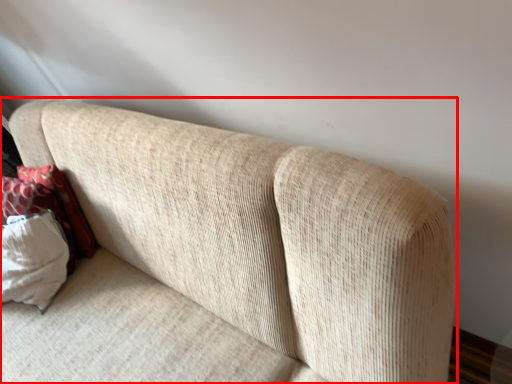
Question: Where is studio couch (annotated by the red box) located in relation to pillow in the image?

Choices:
 (A) left
 (B) right

Answer: (B)